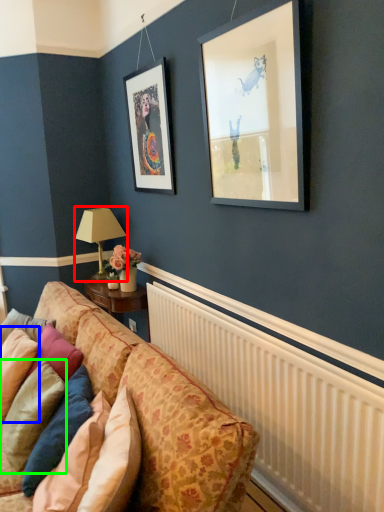
Question: Considering the real-world distances, which object is farthest from table lamp (highlighted by a red box)? pillow (highlighted by a blue box) or pillow (highlighted by a green box)?

Choices:
 (A) pillow
 (B) pillow

Answer: (B)